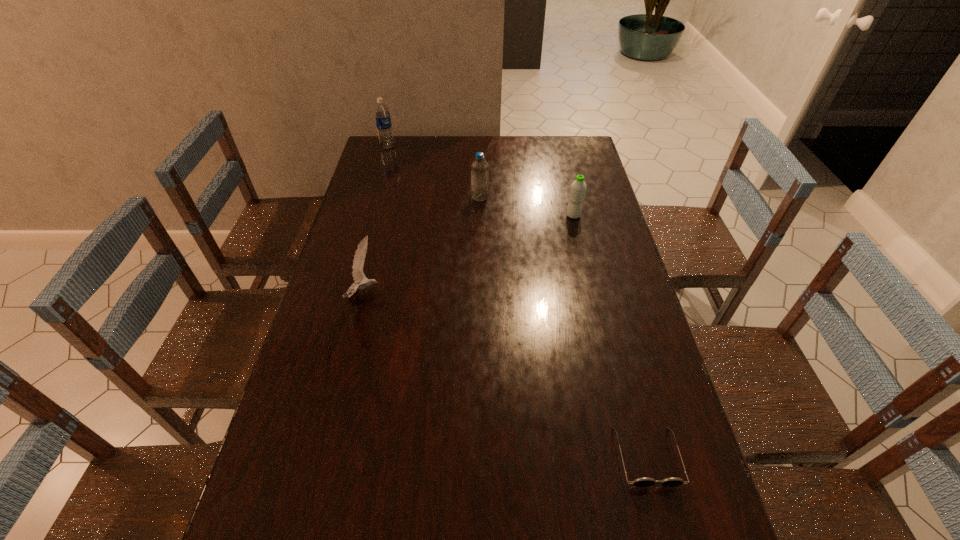
Locate an element on the screen. This screenshot has height=540, width=960. object situated at the far left corner is located at coordinates (382, 114).

Identify the location of vacant area at the far edge. This screenshot has width=960, height=540. (492, 149).

In the image, there is a desktop. Where is `vacant space at the left edge`? vacant space at the left edge is located at coordinates (343, 391).

Identify the location of vacant space at the right edge. This screenshot has width=960, height=540. point(593,193).

Where is `vacant region at the far right corner`? This screenshot has width=960, height=540. vacant region at the far right corner is located at coordinates (564, 160).

Find the location of a particular element. free area in between the nearest water bottle and the nearest object is located at coordinates (610, 336).

Locate an element on the screen. Image resolution: width=960 pixels, height=540 pixels. vacant space in between the tallest water bottle and the second shortest object is located at coordinates (376, 221).

I want to click on free area in between the third farthest object and the shortest object, so click(610, 336).

At what (x,y) coordinates should I click in order to perform the action: click on free space between the second nearest water bottle and the fourth farthest object. Please return your answer as a coordinate pair (x, y). Looking at the image, I should click on (422, 246).

You are a GUI agent. You are given a task and a screenshot of the screen. Output one action in this format:
    pyautogui.click(x=<x>, y=<y>)
    Task: Click on the free space between the fourth farthest object and the farthest water bottle
    The image size is (960, 540).
    Given the screenshot: What is the action you would take?
    pyautogui.click(x=376, y=221)